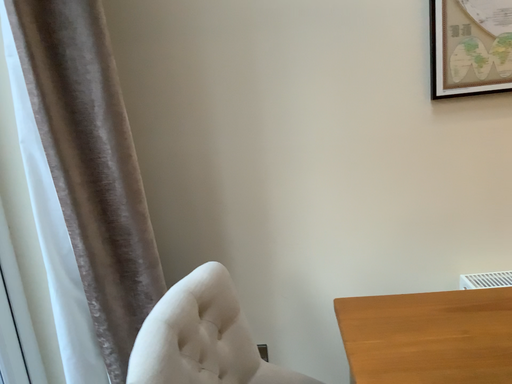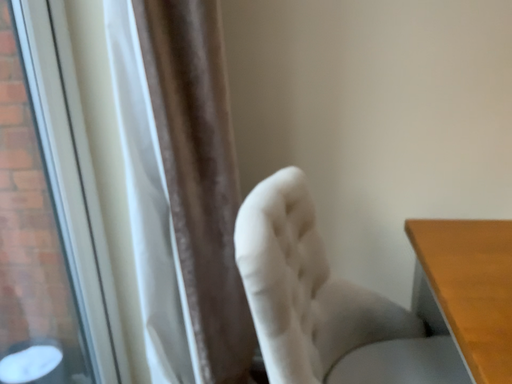
Question: How did the camera likely rotate when shooting the video?

Choices:
 (A) rotated downward
 (B) rotated upward

Answer: (A)